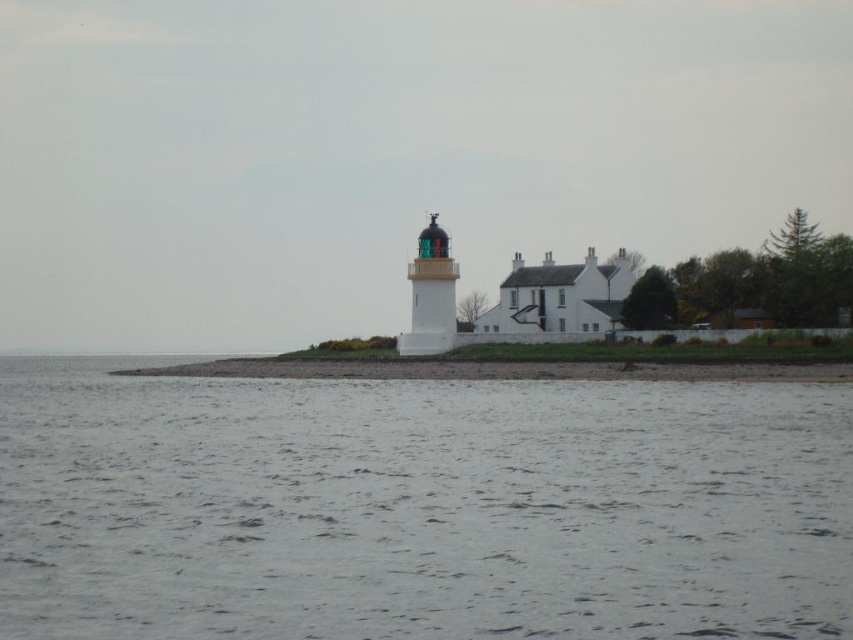
Question: Where is smooth sand at lower center located in relation to white painted brick lighthouse at center in the image?

Choices:
 (A) right
 (B) left

Answer: (B)

Question: Does gray water at lower center have a greater width compared to smooth sand at lower center?

Choices:
 (A) yes
 (B) no

Answer: (B)

Question: Considering the real-world distances, which object is closest to the white painted brick lighthouse at center?

Choices:
 (A) gray water at lower center
 (B) smooth sand at lower center

Answer: (B)

Question: Among these objects, which one is farthest from the camera?

Choices:
 (A) smooth sand at lower center
 (B) white painted brick lighthouse at center

Answer: (B)

Question: Among these objects, which one is farthest from the camera?

Choices:
 (A) gray water at lower center
 (B) white painted brick lighthouse at center
 (C) smooth sand at lower center

Answer: (B)

Question: Can you confirm if gray water at lower center is wider than white painted brick lighthouse at center?

Choices:
 (A) yes
 (B) no

Answer: (A)